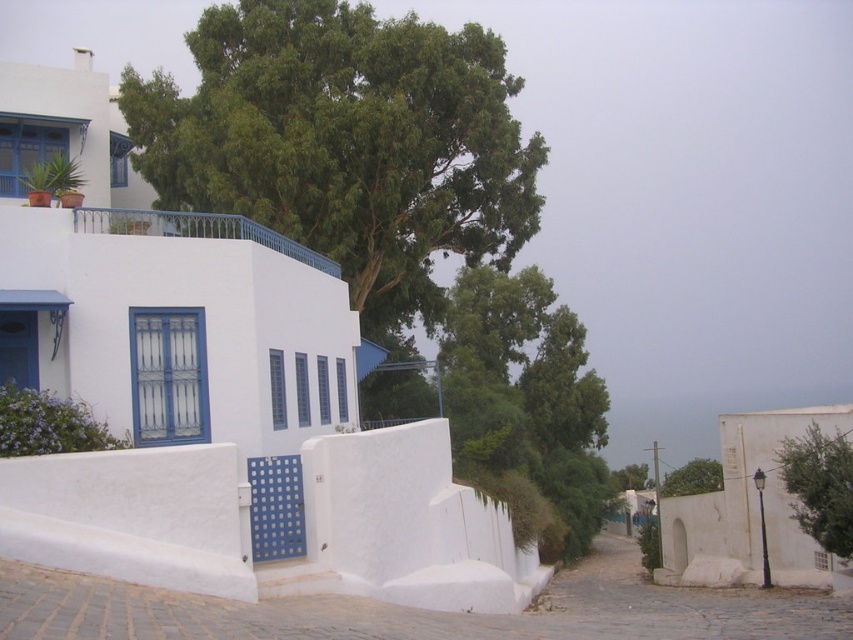
You are a landscape architect designing a new garden between the green leafy tree at upper center and the green leafy tree at center. The garden must be 70 feet long. Can you fit the garden between them?

The distance between the green leafy tree at upper center and the green leafy tree at center is 72.06 feet, so yes, the garden can be placed between them since it is longer than the required 70 feet.

You are standing in front of the Mediterranean village scene. You want to take a photo of the green leafy tree at right. If your camera can focus on objects up to 20 meters away, will you be able to capture a clear photo of the tree?

The green leafy tree at right is 16.91 meters away from the camera, which is within the camera focus range of up to 20 meters. Therefore, you can capture a clear photo of the green leafy tree at right.